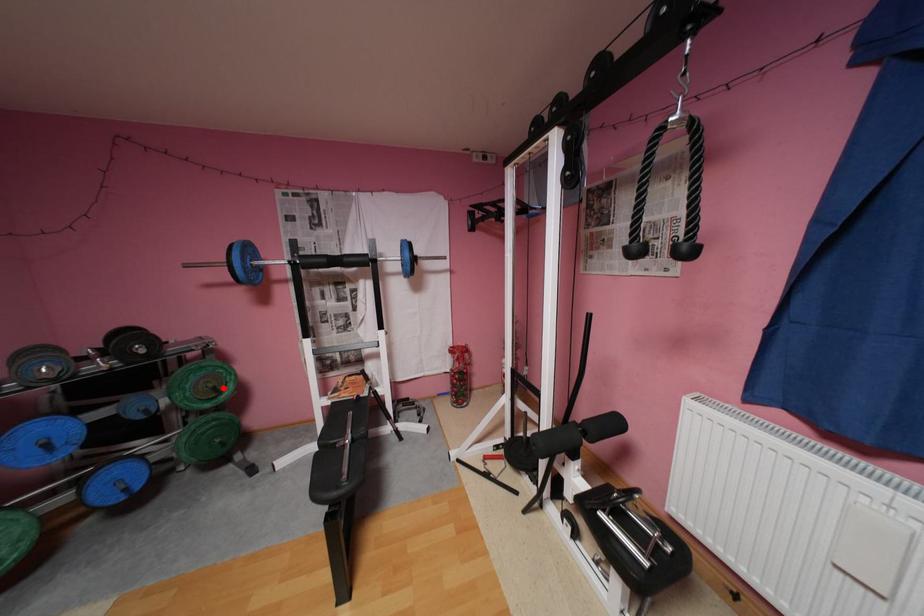
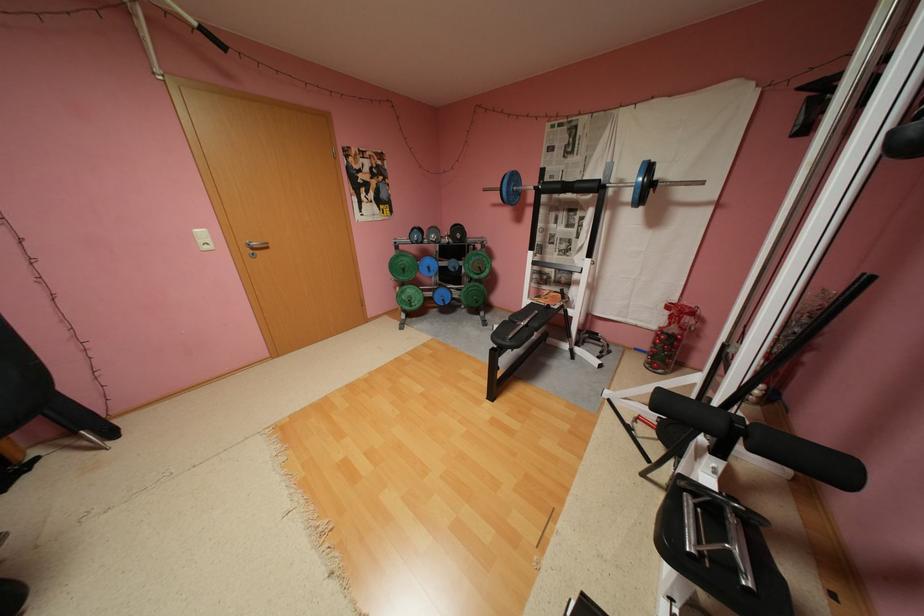
The point at the highlighted location is marked in the first image. Where is the corresponding point in the second image?

(489, 267)